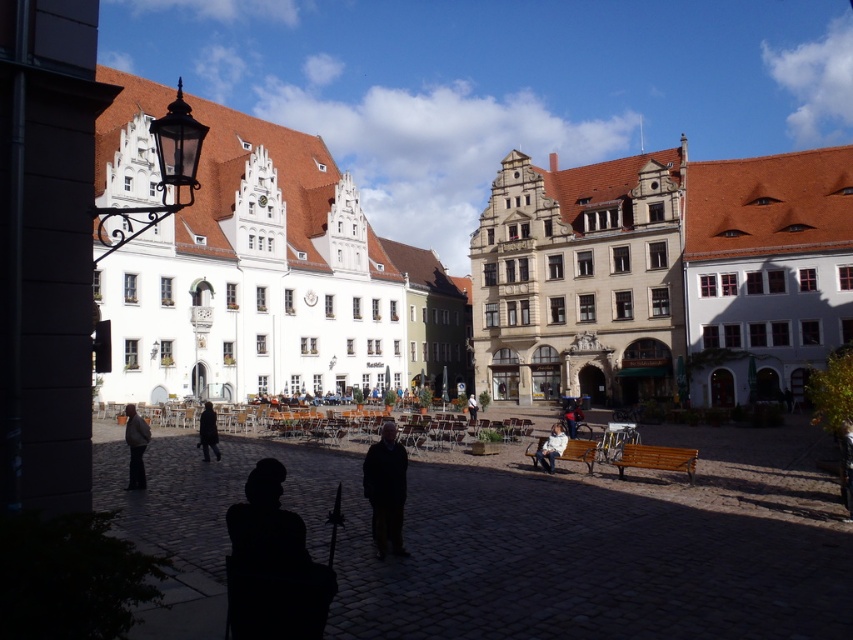
Question: Which is nearer to the white stone building at upper left?

Choices:
 (A) dark gray jacket at center
 (B) black wool coat at center

Answer: (A)

Question: Can you confirm if white stone building at upper left is smaller than silhouette fabric at center?

Choices:
 (A) yes
 (B) no

Answer: (B)

Question: Does light brown wooden bench at lower right lie in front of black wool coat at center?

Choices:
 (A) yes
 (B) no

Answer: (A)

Question: Can you confirm if white stone building at upper left is positioned to the left of dark blue jeans at center?

Choices:
 (A) no
 (B) yes

Answer: (A)

Question: Estimate the real-world distances between objects in this image. Which object is closer to the light brown wooden bench at lower right?

Choices:
 (A) black wool coat at center
 (B) white stone building at upper left

Answer: (A)

Question: Considering the real-world distances, which object is closest to the light brown wooden bench at lower right?

Choices:
 (A) white stone building at upper left
 (B) black wool coat at center
 (C) dark gray jacket at lower left
 (D) dark blue jeans at center

Answer: (D)